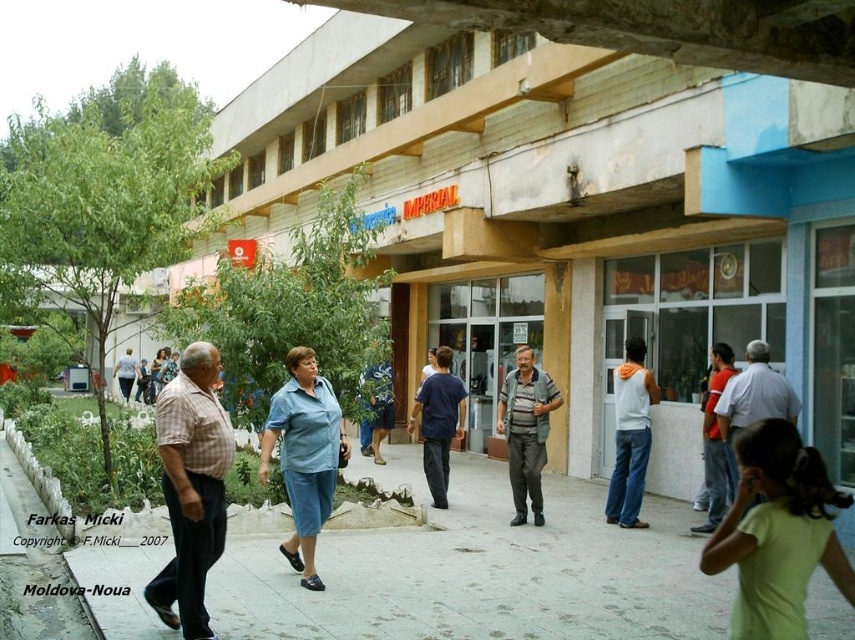
Question: Can you confirm if gray striped shirt at center is wider than light blue denim pants at center?

Choices:
 (A) no
 (B) yes

Answer: (A)

Question: Where is orange shirt at right located in relation to light blue denim pants at center in the image?

Choices:
 (A) left
 (B) right

Answer: (B)

Question: Can you confirm if plaid cotton shirt at center is positioned to the right of light blue denim pants at center?

Choices:
 (A) no
 (B) yes

Answer: (B)

Question: Which point is farther to the camera?

Choices:
 (A) gray concrete pavement at center
 (B) light blue shirt at center
 (C) gray striped shirt at center
 (D) light green fabric at lower right

Answer: (C)

Question: Which of the following is the closest to the observer?

Choices:
 (A) blue cotton shirt at center
 (B) light green fabric at lower right
 (C) gray striped shirt at center

Answer: (B)

Question: Among these objects, which one is nearest to the camera?

Choices:
 (A) dark blue shirt at center
 (B) orange shirt at right

Answer: (B)